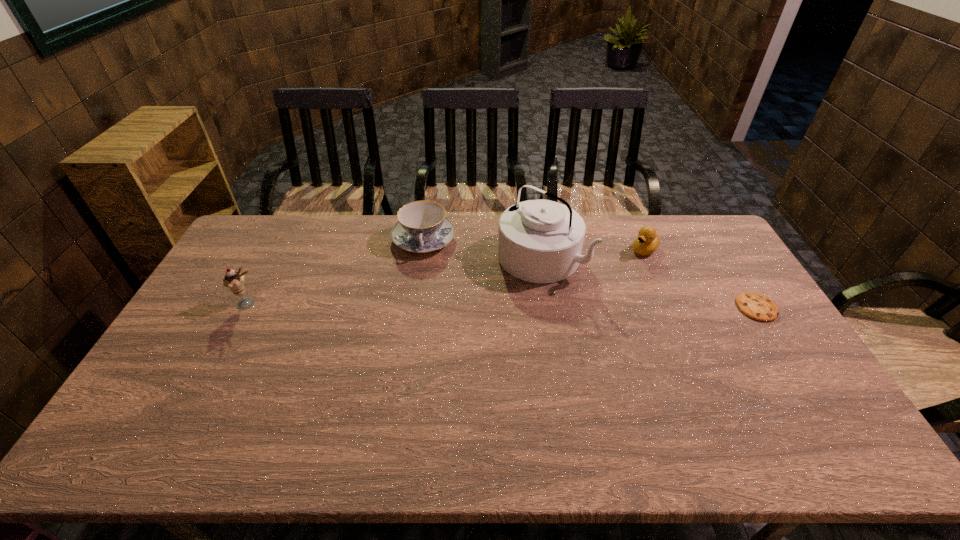
Find the location of a particular element. The width and height of the screenshot is (960, 540). object identified as the second closest to the chinaware is located at coordinates (234, 281).

This screenshot has height=540, width=960. What are the coordinates of `vacant area that satisfies the following two spatial constraints: 1. on the front side of the second object from right to left; 2. on the right side of the chinaware` in the screenshot? It's located at (422, 249).

The image size is (960, 540). Find the location of `blank area in the image that satisfies the following two spatial constraints: 1. on the front side of the fourth shortest object; 2. on the left side of the cookie`. blank area in the image that satisfies the following two spatial constraints: 1. on the front side of the fourth shortest object; 2. on the left side of the cookie is located at coordinates (247, 308).

Image resolution: width=960 pixels, height=540 pixels. In order to click on free location that satisfies the following two spatial constraints: 1. on the back side of the third object from left to right; 2. on the right side of the leftmost object in this screenshot , I will do `click(274, 256)`.

The image size is (960, 540). I want to click on vacant space that satisfies the following two spatial constraints: 1. on the front side of the second object from right to left; 2. on the left side of the rightmost object, so click(x=670, y=308).